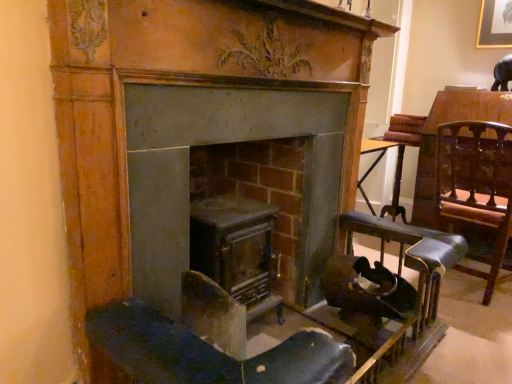
Question: In the image, is metallic gray stove at center, which ranks as the first fireplace in left-to-right order, positioned in front of or behind matte gray fireplace at center, the 1th fireplace when ordered from right to left?

Choices:
 (A) behind
 (B) front

Answer: (A)

Question: Based on their positions, is metallic gray stove at center, which ranks as the first fireplace in left-to-right order, located to the left or right of matte gray fireplace at center, the 1th fireplace when ordered from right to left?

Choices:
 (A) left
 (B) right

Answer: (A)

Question: Which of these objects is positioned closest to the metallic gray stove at center, which ranks as the first fireplace in left-to-right order?

Choices:
 (A) leather seat at right
 (B) matte gray fireplace at center, which is the 2th fireplace in left-to-right order

Answer: (B)

Question: Estimate the real-world distances between objects in this image. Which object is closer to the matte gray fireplace at center, the 1th fireplace when ordered from right to left?

Choices:
 (A) leather seat at right
 (B) metallic gray stove at center, which ranks as the first fireplace in left-to-right order

Answer: (B)